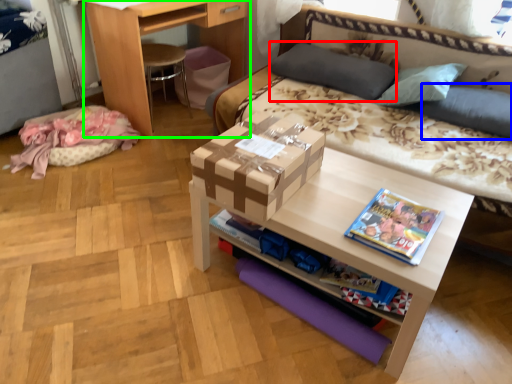
Question: Which object is positioned closest to pillow (highlighted by a red box)? Select from pillow (highlighted by a blue box) and desk (highlighted by a green box).

Choices:
 (A) pillow
 (B) desk

Answer: (A)